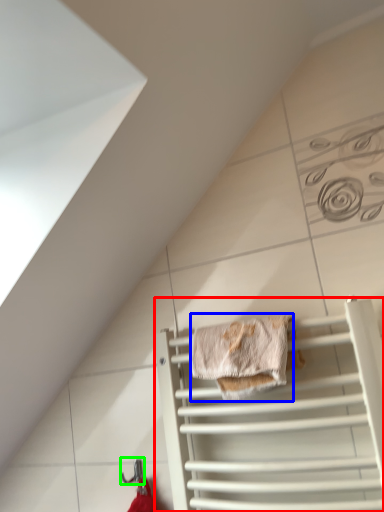
Question: Considering the real-world distances, which object is farthest from cage (highlighted by a red box)? material (highlighted by a blue box) or hanger (highlighted by a green box)?

Choices:
 (A) material
 (B) hanger

Answer: (B)